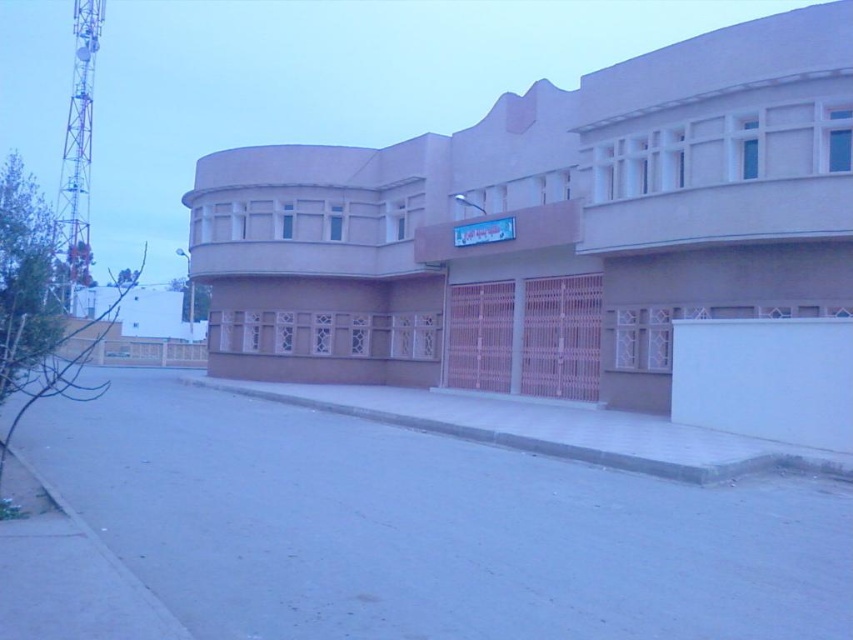
Does beige concrete building at center appear on the right side of gray concrete curb at lower center?

Incorrect, beige concrete building at center is not on the right side of gray concrete curb at lower center.

Which is in front, point (757, 236) or point (666, 432)?

Positioned in front is point (666, 432).

Who is more distant from viewer, (288, 333) or (503, 445)?

Positioned behind is point (288, 333).

Identify the location of beige concrete building at center. (566, 241).